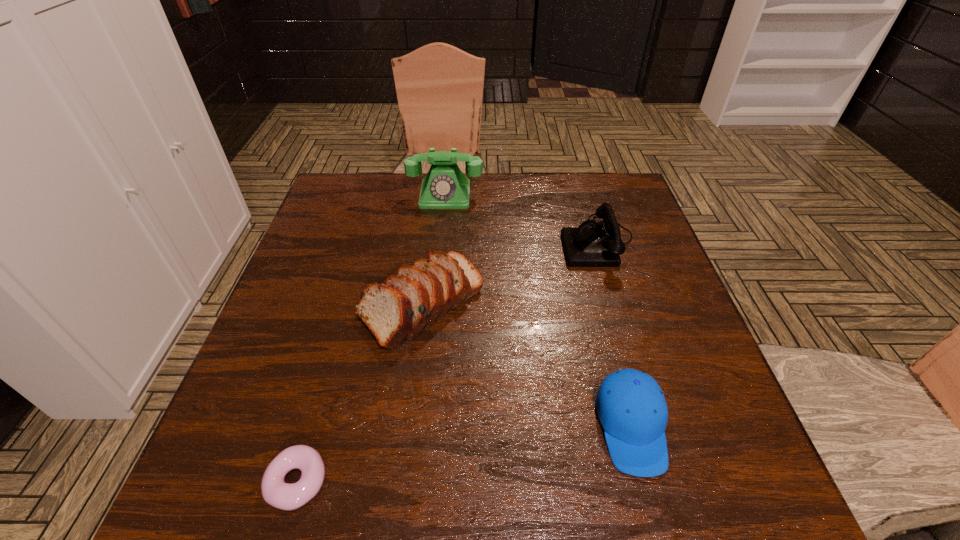
Locate an element on the screen. The image size is (960, 540). free point located 0.070m on the front face of the right telephone is located at coordinates (535, 241).

At what (x,y) coordinates should I click in order to perform the action: click on vacant area situated on the front of the bread. Please return your answer as a coordinate pair (x, y). Looking at the image, I should click on (405, 426).

Find the location of a particular element. free space located 0.240m on the right of the shortest object is located at coordinates (474, 482).

Find the location of a particular element. This screenshot has width=960, height=540. cap present at the near edge is located at coordinates (630, 405).

Find the location of a particular element. doughnut that is at the near edge is located at coordinates (277, 493).

Where is `object present at the left edge`? This screenshot has width=960, height=540. object present at the left edge is located at coordinates (277, 493).

Where is `telephone present at the right edge`? telephone present at the right edge is located at coordinates (592, 244).

Where is `cap that is at the right edge`? This screenshot has width=960, height=540. cap that is at the right edge is located at coordinates (630, 405).

Where is `object at the near left corner`? This screenshot has height=540, width=960. object at the near left corner is located at coordinates pos(277,493).

Where is `object that is at the far right corner`? The width and height of the screenshot is (960, 540). object that is at the far right corner is located at coordinates (592, 244).